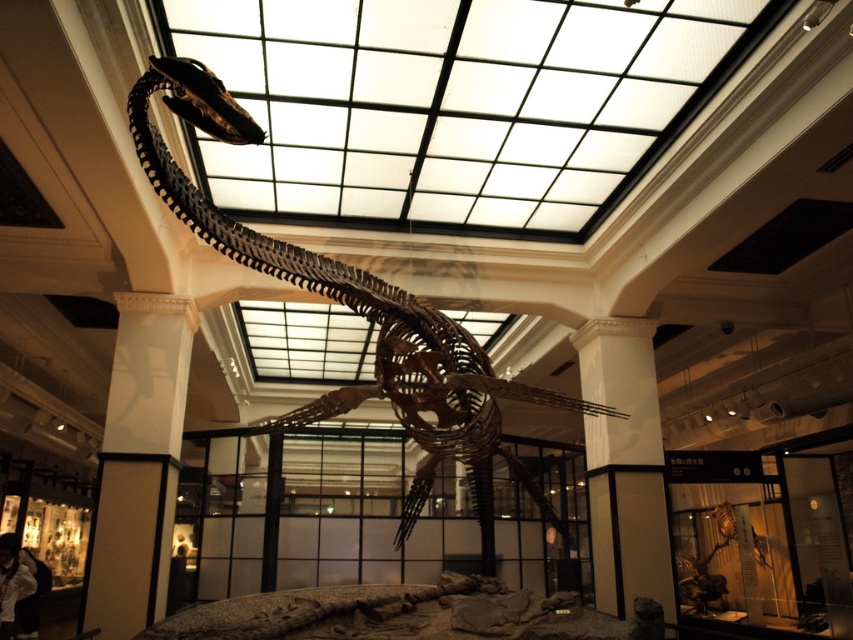
You are a visitor in the museum and want to take a photo of the brown wooden skeleton at center without the white glossy pillar at lower left appearing in the shot. Is this possible based on their positions?

The brown wooden skeleton at center is in front of the white glossy pillar at lower left, so it would block the pillar from view. Therefore, you can take a photo of the brown wooden skeleton at center without the white glossy pillar at lower left appearing in the shot.

You are standing in the museum facing the plesiosaur skeleton. There are two points marked on the floor in front of you. One is at point (297, 252) and the other is at point (625, 552). Which point is closer to you?

Point (297, 252) is closer to you because it is in front of point (625, 552).

You are a visitor standing at the entrance of the museum and want to take a photo of the white glossy pillar at lower left and the white smooth pillar at center. Which pillar should you focus on first if you want to capture both in the same frame without moving your camera?

The white glossy pillar at lower left is located above the white smooth pillar at center, so you should focus on the white glossy pillar at lower left first to ensure both pillars are in the frame without moving the camera.